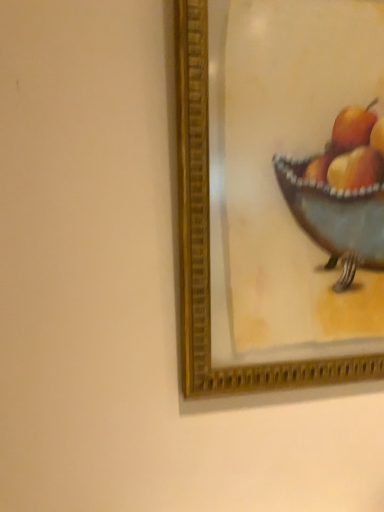
Describe the element at coordinates (209, 240) in the screenshot. I see `gold metallic frame at upper right` at that location.

The image size is (384, 512). I want to click on gold metallic frame at upper right, so click(x=209, y=240).

This screenshot has height=512, width=384. Find the location of `gold metallic frame at upper right`. gold metallic frame at upper right is located at coordinates (209, 240).